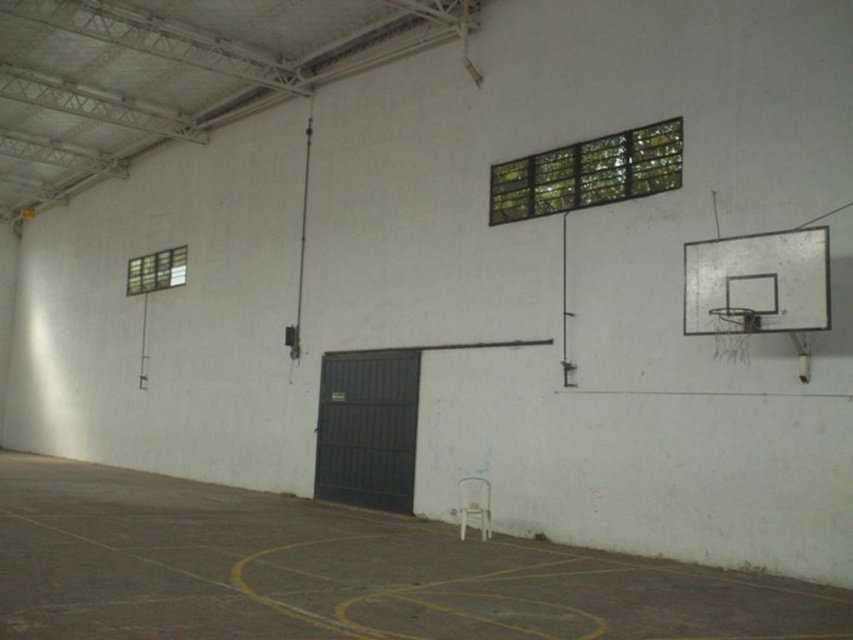
Question: Among these objects, which one is nearest to the camera?

Choices:
 (A) metallic silver basketball hoop at right
 (B) white plastic chair at center

Answer: (B)

Question: Which point is closer to the camera?

Choices:
 (A) white plastic chair at center
 (B) metallic silver basketball hoop at right

Answer: (A)

Question: Is white plastic chair at center to the left of metallic silver basketball hoop at right from the viewer's perspective?

Choices:
 (A) yes
 (B) no

Answer: (A)

Question: In this image, where is white plastic chair at center located relative to metallic silver basketball hoop at right?

Choices:
 (A) below
 (B) above

Answer: (A)

Question: Is white plastic chair at center above metallic silver basketball hoop at right?

Choices:
 (A) yes
 (B) no

Answer: (B)